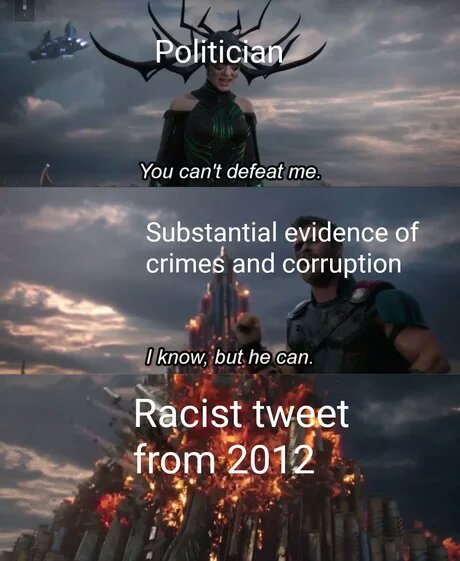
Find the location of a particular element. light is located at coordinates (100, 309), (81, 472).